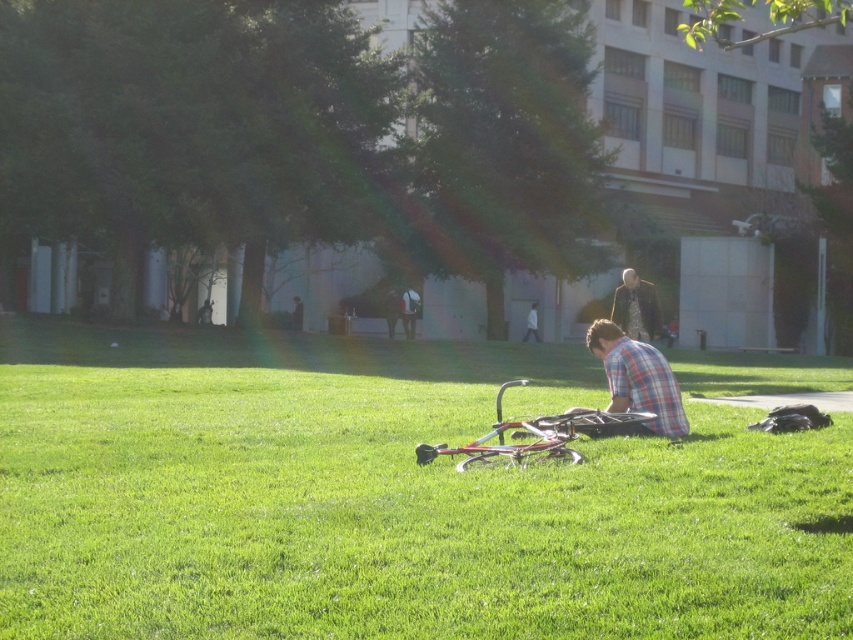
From the picture: You are standing at the point with coordinates (387,499). What object is located exactly at your current position?

The metallic bicycle at center is located exactly at the point with coordinates (387,499).

You are standing at the origin point in the coordinate system of this image. You want to walk straight towards the metallic bicycle at center. What coordinate point will you arrive at when you reach the bicycle?

You will arrive at the coordinate point of the metallic bicycle at center, which is at point (387, 499).